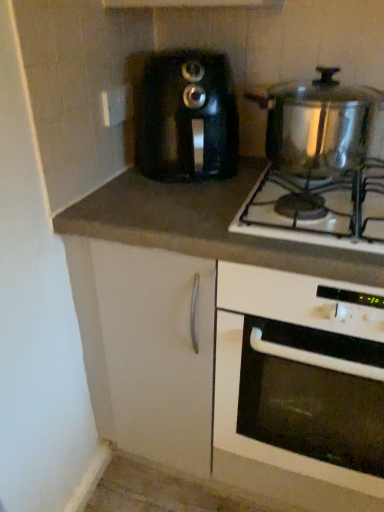
Locate an element on the screen. This screenshot has height=512, width=384. white plastic electric outlet at upper center is located at coordinates (114, 106).

What do you see at coordinates (114, 106) in the screenshot?
I see `white plastic electric outlet at upper center` at bounding box center [114, 106].

Describe the element at coordinates (202, 225) in the screenshot. I see `dark gray laminate countertop at center` at that location.

Locate an element on the screen. dark gray laminate countertop at center is located at coordinates (202, 225).

What do you see at coordinates (186, 117) in the screenshot? Image resolution: width=384 pixels, height=512 pixels. I see `black plastic toaster at center` at bounding box center [186, 117].

Where is `shiny metallic pot at upper right`? Image resolution: width=384 pixels, height=512 pixels. shiny metallic pot at upper right is located at coordinates (321, 124).

Between white glossy oven at center and dark gray laminate countertop at center, which one has smaller size?

dark gray laminate countertop at center.

Locate an element on the screen. The width and height of the screenshot is (384, 512). countertop above the white glossy oven at center (from the image's perspective) is located at coordinates (202, 225).

Can you confirm if white glossy oven at center is thinner than dark gray laminate countertop at center?

No, white glossy oven at center is not thinner than dark gray laminate countertop at center.

Is white glossy oven at center positioned in front of dark gray laminate countertop at center?

Yes.

From a real-world perspective, is white glossy oven at center beneath black plastic toaster at center?

Indeed, from a real-world perspective, white glossy oven at center is positioned beneath black plastic toaster at center.

Which object is thinner, white glossy oven at center or black plastic toaster at center?

black plastic toaster at center is thinner.

Based on the photo, is white glossy oven at center positioned far away from black plastic toaster at center?

white glossy oven at center is actually quite close to black plastic toaster at center.

Consider the image. From the image's perspective, which is above, dark gray laminate countertop at center or white glossy oven at center?

dark gray laminate countertop at center is shown above in the image.

From the picture: Are dark gray laminate countertop at center and white glossy oven at center located far from each other?

dark gray laminate countertop at center is actually quite close to white glossy oven at center.

Considering the relative positions of dark gray laminate countertop at center and white glossy oven at center in the image provided, is dark gray laminate countertop at center to the right of white glossy oven at center from the viewer's perspective?

Incorrect, dark gray laminate countertop at center is not on the right side of white glossy oven at center.

Considering the relative sizes of dark gray laminate countertop at center and white glossy oven at center in the image provided, is dark gray laminate countertop at center shorter than white glossy oven at center?

Yes, dark gray laminate countertop at center is shorter than white glossy oven at center.

From a real-world perspective, between shiny metallic pot at upper right and white plastic electric outlet at upper center, who is vertically lower?

shiny metallic pot at upper right.

This screenshot has width=384, height=512. Find the location of `electric outlet behind the shiny metallic pot at upper right`. electric outlet behind the shiny metallic pot at upper right is located at coordinates (114, 106).

Considering the relative positions of shiny metallic pot at upper right and white plastic electric outlet at upper center in the image provided, is shiny metallic pot at upper right to the left of white plastic electric outlet at upper center from the viewer's perspective?

In fact, shiny metallic pot at upper right is to the right of white plastic electric outlet at upper center.

Based on the photo, is shiny metallic pot at upper right next to white plastic electric outlet at upper center?

No.

Is shiny metallic pot at upper right at the back of white plastic electric outlet at upper center?

No.

In the scene shown: Which object is wider, white plastic electric outlet at upper center or shiny metallic pot at upper right?

shiny metallic pot at upper right is wider.

Does white plastic electric outlet at upper center touch shiny metallic pot at upper right?

There is a gap between white plastic electric outlet at upper center and shiny metallic pot at upper right.

Is dark gray laminate countertop at center positioned in front of shiny metallic pot at upper right?

Yes, it is in front of shiny metallic pot at upper right.

Does dark gray laminate countertop at center appear on the left side of shiny metallic pot at upper right?

Correct, you'll find dark gray laminate countertop at center to the left of shiny metallic pot at upper right.

Is dark gray laminate countertop at center taller than shiny metallic pot at upper right?

Yes.

From the picture: Are dark gray laminate countertop at center and shiny metallic pot at upper right far apart?

That's not correct — dark gray laminate countertop at center is a little close to shiny metallic pot at upper right.

Which of these two, white glossy oven at center or shiny metallic pot at upper right, stands shorter?

shiny metallic pot at upper right is shorter.

Is white glossy oven at center inside the boundaries of shiny metallic pot at upper right, or outside?

white glossy oven at center is not enclosed by shiny metallic pot at upper right.

Is white glossy oven at center looking in the opposite direction of shiny metallic pot at upper right?

No.

Is white glossy oven at center next to shiny metallic pot at upper right?

No, white glossy oven at center is not in contact with shiny metallic pot at upper right.

This screenshot has height=512, width=384. What are the coordinates of `oven below the dark gray laminate countertop at center (from a real-world perspective)` in the screenshot? It's located at (291, 362).

This screenshot has width=384, height=512. I want to click on toaster lying on the left of white glossy oven at center, so (x=186, y=117).

When comparing their distances from shiny metallic pot at upper right, does black plastic toaster at center or dark gray laminate countertop at center seem closer?

Among the two, black plastic toaster at center is located nearer to shiny metallic pot at upper right.

Which object lies further to the anchor point dark gray laminate countertop at center, white plastic electric outlet at upper center or white glossy oven at center?

white plastic electric outlet at upper center is positioned further to the anchor dark gray laminate countertop at center.

Based on their spatial positions, is shiny metallic pot at upper right or white glossy oven at center closer to white plastic electric outlet at upper center?

shiny metallic pot at upper right is positioned closer to the anchor white plastic electric outlet at upper center.

Looking at the image, which one is located closer to shiny metallic pot at upper right, shiny metallic pot at upper right or white plastic electric outlet at upper center?

The object closer to shiny metallic pot at upper right is shiny metallic pot at upper right.

When comparing their distances from shiny metallic pot at upper right, does black plastic toaster at center or dark gray laminate countertop at center seem closer?

dark gray laminate countertop at center lies closer to shiny metallic pot at upper right than the other object.

Looking at the image, which one is located closer to white plastic electric outlet at upper center, white glossy oven at center or black plastic toaster at center?

Based on the image, black plastic toaster at center appears to be nearer to white plastic electric outlet at upper center.

Based on their spatial positions, is shiny metallic pot at upper right or white plastic electric outlet at upper center closer to shiny metallic pot at upper right?

shiny metallic pot at upper right is closer to shiny metallic pot at upper right.

In the scene shown: Estimate the real-world distances between objects in this image. Which object is closer to dark gray laminate countertop at center, white plastic electric outlet at upper center or shiny metallic pot at upper right?

shiny metallic pot at upper right is positioned closer to the anchor dark gray laminate countertop at center.

This screenshot has height=512, width=384. Identify the location of gas stove between black plastic toaster at center and dark gray laminate countertop at center in the vertical direction. (318, 209).

I want to click on kitchen appliance between white plastic electric outlet at upper center and dark gray laminate countertop at center vertically, so click(321, 124).

The width and height of the screenshot is (384, 512). What are the coordinates of `toaster between white plastic electric outlet at upper center and dark gray laminate countertop at center from top to bottom` in the screenshot? It's located at (186, 117).

Identify the location of toaster situated between white plastic electric outlet at upper center and shiny metallic pot at upper right from left to right. The width and height of the screenshot is (384, 512). (186, 117).